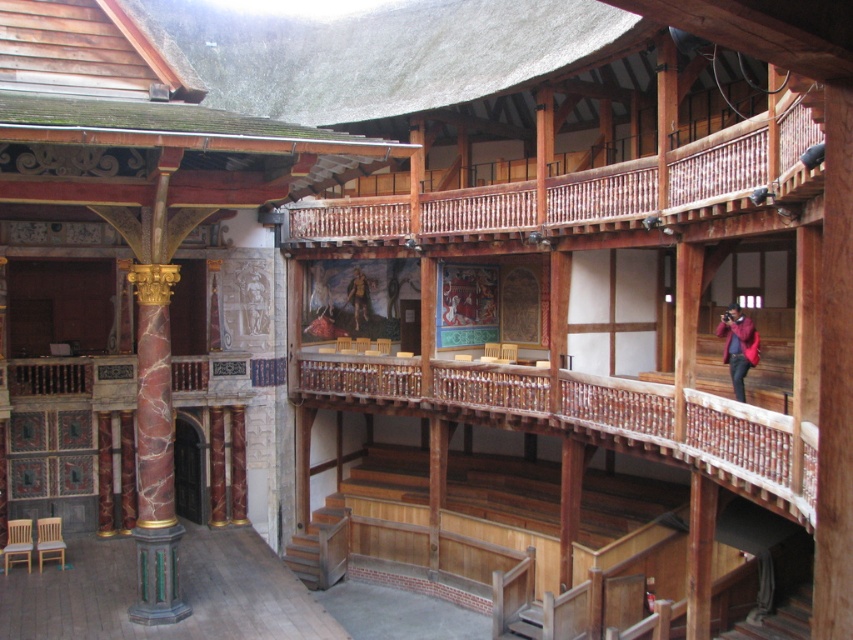
You are an actor preparing for a performance in this theater. You see the red velvet coat at upper right and the brown leather armor at center. Which item is closer to the stage where you will perform?

The red velvet coat at upper right is in front of the brown leather armor at center, so it is closer to the stage.